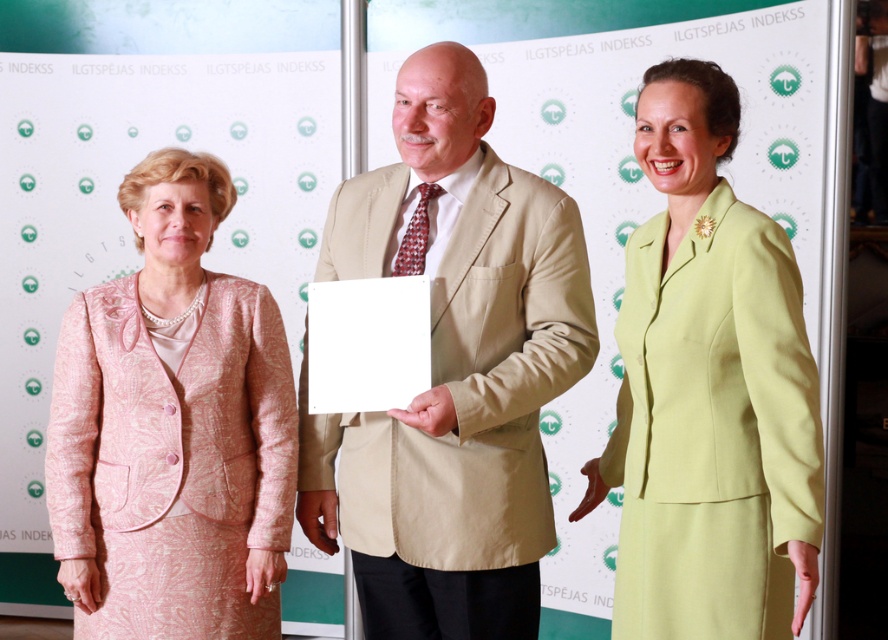
Question: Can you confirm if beige fabric suit at center is smaller than pink textured suit at left?

Choices:
 (A) no
 (B) yes

Answer: (A)

Question: Based on their relative distances, which object is nearer to the lime green fabric suit at right?

Choices:
 (A) beige fabric suit at center
 (B) pink textured suit at left

Answer: (A)

Question: From the image, what is the correct spatial relationship of beige fabric suit at center in relation to lime green fabric suit at right?

Choices:
 (A) below
 (B) above

Answer: (B)

Question: Which object is positioned farthest from the pink textured suit at left?

Choices:
 (A) lime green fabric suit at right
 (B) beige fabric suit at center

Answer: (A)

Question: Can you confirm if beige fabric suit at center is positioned to the right of lime green fabric suit at right?

Choices:
 (A) yes
 (B) no

Answer: (B)

Question: Which of the following is the closest to the observer?

Choices:
 (A) (474, 560)
 (B) (155, 509)

Answer: (A)